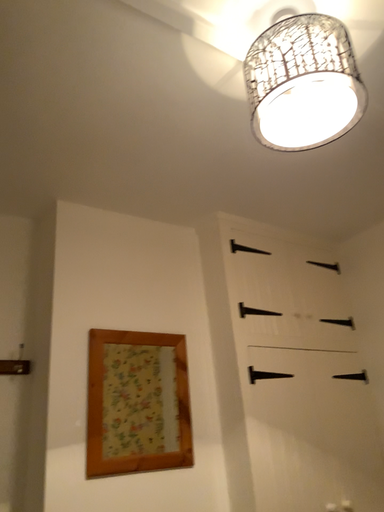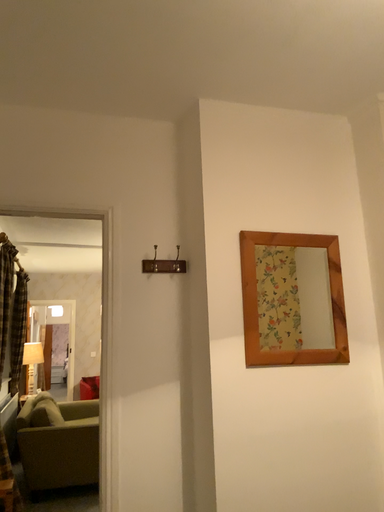
Question: Which way did the camera rotate in the video?

Choices:
 (A) rotated right
 (B) rotated left

Answer: (B)